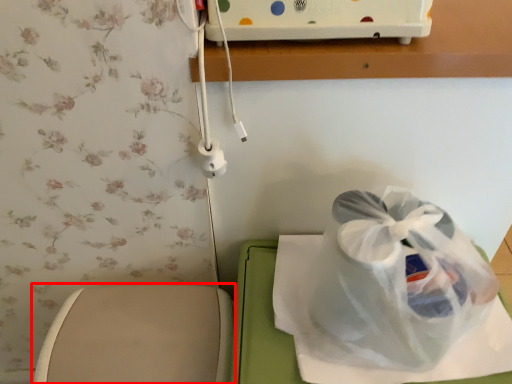
Question: From the image's perspective, where is toilet (annotated by the red box) located relative to plastic bag?

Choices:
 (A) above
 (B) below

Answer: (B)